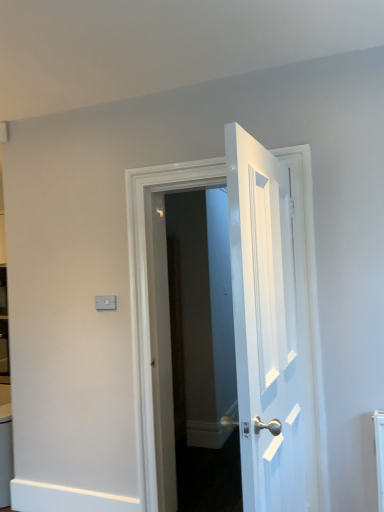
Question: Does white glossy door at center, the first door from the front, appear on the left side of white wooden door at center, the 1th door when ordered from back to front?

Choices:
 (A) no
 (B) yes

Answer: (A)

Question: Is white glossy door at center, the second door viewed from the back, wider than white wooden door at center, the 1th door when ordered from back to front?

Choices:
 (A) yes
 (B) no

Answer: (B)

Question: Is white glossy door at center, the second door viewed from the back, facing towards white wooden door at center, the second door from the front?

Choices:
 (A) no
 (B) yes

Answer: (A)

Question: Is white glossy door at center, the second door viewed from the back, positioned beyond the bounds of white wooden door at center, the second door from the front?

Choices:
 (A) no
 (B) yes

Answer: (B)

Question: From the image's perspective, is white glossy door at center, the first door from the front, beneath white wooden door at center, the 1th door when ordered from back to front?

Choices:
 (A) yes
 (B) no

Answer: (B)

Question: Considering the relative sizes of white glossy door at center, the second door viewed from the back, and white wooden door at center, the second door from the front, in the image provided, is white glossy door at center, the second door viewed from the back, thinner than white wooden door at center, the second door from the front,?

Choices:
 (A) no
 (B) yes

Answer: (B)

Question: Considering the relative positions of white wooden door at center, the 1th door when ordered from back to front, and white glossy door at center, the first door from the front, in the image provided, is white wooden door at center, the 1th door when ordered from back to front, behind white glossy door at center, the first door from the front,?

Choices:
 (A) no
 (B) yes

Answer: (B)

Question: From a real-world perspective, is white wooden door at center, the 1th door when ordered from back to front, located beneath white glossy door at center, the second door viewed from the back?

Choices:
 (A) yes
 (B) no

Answer: (A)

Question: Considering the relative sizes of white wooden door at center, the second door from the front, and white glossy door at center, the second door viewed from the back, in the image provided, is white wooden door at center, the second door from the front, thinner than white glossy door at center, the second door viewed from the back,?

Choices:
 (A) no
 (B) yes

Answer: (A)

Question: Considering the relative positions of white wooden door at center, the 1th door when ordered from back to front, and white glossy door at center, the second door viewed from the back, in the image provided, is white wooden door at center, the 1th door when ordered from back to front, to the right of white glossy door at center, the second door viewed from the back, from the viewer's perspective?

Choices:
 (A) no
 (B) yes

Answer: (A)

Question: Considering the relative sizes of white wooden door at center, the second door from the front, and white glossy door at center, the second door viewed from the back, in the image provided, is white wooden door at center, the second door from the front, wider than white glossy door at center, the second door viewed from the back,?

Choices:
 (A) yes
 (B) no

Answer: (A)

Question: Based on their sizes in the image, would you say white wooden door at center, the second door from the front, is bigger or smaller than white glossy door at center, the first door from the front?

Choices:
 (A) big
 (B) small

Answer: (A)